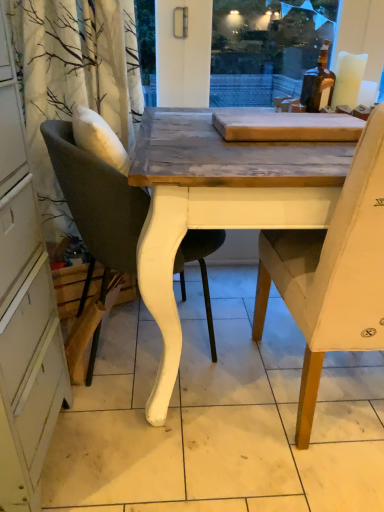
This screenshot has width=384, height=512. What do you see at coordinates (97, 199) in the screenshot?
I see `matte gray cushioned chair at left, the first chair when ordered from left to right` at bounding box center [97, 199].

Locate an element on the screen. The image size is (384, 512). matte gray cushioned chair at left, the second chair viewed from the right is located at coordinates (97, 199).

The height and width of the screenshot is (512, 384). What do you see at coordinates (332, 272) in the screenshot? I see `light beige fabric chair at right, which appears as the 2th chair when viewed from the left` at bounding box center [332, 272].

At what (x,y) coordinates should I click in order to perform the action: click on light beige fabric chair at right, which appears as the 2th chair when viewed from the left. Please return your answer as a coordinate pair (x, y). Looking at the image, I should click on (332, 272).

Measure the distance between point (357, 319) and camera.

Point (357, 319) and camera are 1.03 meters apart from each other.

Identify the location of matte gray cushioned chair at left, the second chair viewed from the right. This screenshot has height=512, width=384. (97, 199).

Consider the image. Would you say matte gray cushioned chair at left, the second chair viewed from the right, is to the left or to the right of light beige fabric chair at right, which is the first chair from right to left, in the picture?

matte gray cushioned chair at left, the second chair viewed from the right, is positioned on light beige fabric chair at right, which is the first chair from right to left,'s left side.

Between matte gray cushioned chair at left, the first chair when ordered from left to right, and light beige fabric chair at right, which appears as the 2th chair when viewed from the left, which one is positioned in front?

light beige fabric chair at right, which appears as the 2th chair when viewed from the left, is more forward.

Which is in front, point (207, 282) or point (302, 263)?

The point (302, 263) is closer.

From the image's perspective, is matte gray cushioned chair at left, the first chair when ordered from left to right, above or below light beige fabric chair at right, which appears as the 2th chair when viewed from the left?

Based on their image positions, matte gray cushioned chair at left, the first chair when ordered from left to right, is located above light beige fabric chair at right, which appears as the 2th chair when viewed from the left.

From a real-world perspective, which object rests below the other?

matte gray cushioned chair at left, the second chair viewed from the right, is physically lower.

Considering the sizes of objects matte gray cushioned chair at left, the second chair viewed from the right, and light beige fabric chair at right, which appears as the 2th chair when viewed from the left, in the image provided, who is thinner, matte gray cushioned chair at left, the second chair viewed from the right, or light beige fabric chair at right, which appears as the 2th chair when viewed from the left,?

Thinner between the two is matte gray cushioned chair at left, the second chair viewed from the right.

Consider the image. From their relative heights in the image, would you say matte gray cushioned chair at left, the first chair when ordered from left to right, is taller or shorter than light beige fabric chair at right, which appears as the 2th chair when viewed from the left?

In the image, matte gray cushioned chair at left, the first chair when ordered from left to right, appears to be shorter than light beige fabric chair at right, which appears as the 2th chair when viewed from the left.

Considering the relative sizes of matte gray cushioned chair at left, the second chair viewed from the right, and light beige fabric chair at right, which appears as the 2th chair when viewed from the left, in the image provided, is matte gray cushioned chair at left, the second chair viewed from the right, smaller than light beige fabric chair at right, which appears as the 2th chair when viewed from the left,?

Yes.

Which is correct: matte gray cushioned chair at left, the first chair when ordered from left to right, is inside light beige fabric chair at right, which appears as the 2th chair when viewed from the left, or outside of it?

matte gray cushioned chair at left, the first chair when ordered from left to right, cannot be found inside light beige fabric chair at right, which appears as the 2th chair when viewed from the left.

Is matte gray cushioned chair at left, the second chair viewed from the right, placed right next to light beige fabric chair at right, which appears as the 2th chair when viewed from the left?

No.

Is matte gray cushioned chair at left, the first chair when ordered from left to right, positioned with its back to light beige fabric chair at right, which is the first chair from right to left?

No.

Measure the distance from matte gray cushioned chair at left, the second chair viewed from the right, to light beige fabric chair at right, which appears as the 2th chair when viewed from the left.

They are 17.26 inches apart.

The width and height of the screenshot is (384, 512). Identify the location of chair below the light beige fabric chair at right, which is the first chair from right to left (from a real-world perspective). (97, 199).

Visually, is light beige fabric chair at right, which is the first chair from right to left, positioned to the left or to the right of matte gray cushioned chair at left, the first chair when ordered from left to right?

light beige fabric chair at right, which is the first chair from right to left, is to the right of matte gray cushioned chair at left, the first chair when ordered from left to right.

Considering the positions of objects light beige fabric chair at right, which appears as the 2th chair when viewed from the left, and matte gray cushioned chair at left, the first chair when ordered from left to right, in the image provided, who is in front, light beige fabric chair at right, which appears as the 2th chair when viewed from the left, or matte gray cushioned chair at left, the first chair when ordered from left to right,?

Positioned in front is light beige fabric chair at right, which appears as the 2th chair when viewed from the left.

Which is less distant, (374, 179) or (81, 183)?

Point (374, 179)

From the image's perspective, is light beige fabric chair at right, which is the first chair from right to left, beneath matte gray cushioned chair at left, the first chair when ordered from left to right?

Yes, from the image's perspective, light beige fabric chair at right, which is the first chair from right to left, is below matte gray cushioned chair at left, the first chair when ordered from left to right.

From a real-world perspective, relative to matte gray cushioned chair at left, the first chair when ordered from left to right, is light beige fabric chair at right, which is the first chair from right to left, vertically above or below?

light beige fabric chair at right, which is the first chair from right to left, is situated higher than matte gray cushioned chair at left, the first chair when ordered from left to right, in the real world.

Looking at their sizes, would you say light beige fabric chair at right, which appears as the 2th chair when viewed from the left, is wider or thinner than matte gray cushioned chair at left, the second chair viewed from the right?

In the image, light beige fabric chair at right, which appears as the 2th chair when viewed from the left, appears to be wider than matte gray cushioned chair at left, the second chair viewed from the right.

Considering the sizes of light beige fabric chair at right, which appears as the 2th chair when viewed from the left, and matte gray cushioned chair at left, the first chair when ordered from left to right, in the image, is light beige fabric chair at right, which appears as the 2th chair when viewed from the left, taller or shorter than matte gray cushioned chair at left, the first chair when ordered from left to right,?

Considering their sizes, light beige fabric chair at right, which appears as the 2th chair when viewed from the left, has more height than matte gray cushioned chair at left, the first chair when ordered from left to right.

Who is smaller, light beige fabric chair at right, which appears as the 2th chair when viewed from the left, or matte gray cushioned chair at left, the first chair when ordered from left to right?

With smaller size is matte gray cushioned chair at left, the first chair when ordered from left to right.

Do you think light beige fabric chair at right, which is the first chair from right to left, is within matte gray cushioned chair at left, the first chair when ordered from left to right, or outside of it?

light beige fabric chair at right, which is the first chair from right to left, is outside matte gray cushioned chair at left, the first chair when ordered from left to right.

Is light beige fabric chair at right, which is the first chair from right to left, far from matte gray cushioned chair at left, the first chair when ordered from left to right?

No, there isn't a large distance between light beige fabric chair at right, which is the first chair from right to left, and matte gray cushioned chair at left, the first chair when ordered from left to right.

Is light beige fabric chair at right, which is the first chair from right to left, looking in the opposite direction of matte gray cushioned chair at left, the second chair viewed from the right?

light beige fabric chair at right, which is the first chair from right to left, is not turned away from matte gray cushioned chair at left, the second chair viewed from the right.

How different are the orientations of light beige fabric chair at right, which is the first chair from right to left, and matte gray cushioned chair at left, the second chair viewed from the right, in degrees?

90 degrees.

Measure the distance from light beige fabric chair at right, which is the first chair from right to left, to matte gray cushioned chair at left, the second chair viewed from the right.

light beige fabric chair at right, which is the first chair from right to left, is 17.26 inches from matte gray cushioned chair at left, the second chair viewed from the right.

Locate an element on the screen. The image size is (384, 512). chair on the right of matte gray cushioned chair at left, the second chair viewed from the right is located at coordinates (332, 272).

Identify the location of chair lying below the matte gray cushioned chair at left, the first chair when ordered from left to right (from the image's perspective). Image resolution: width=384 pixels, height=512 pixels. (332, 272).

Identify the location of chair located on the right of matte gray cushioned chair at left, the first chair when ordered from left to right. The image size is (384, 512). (332, 272).